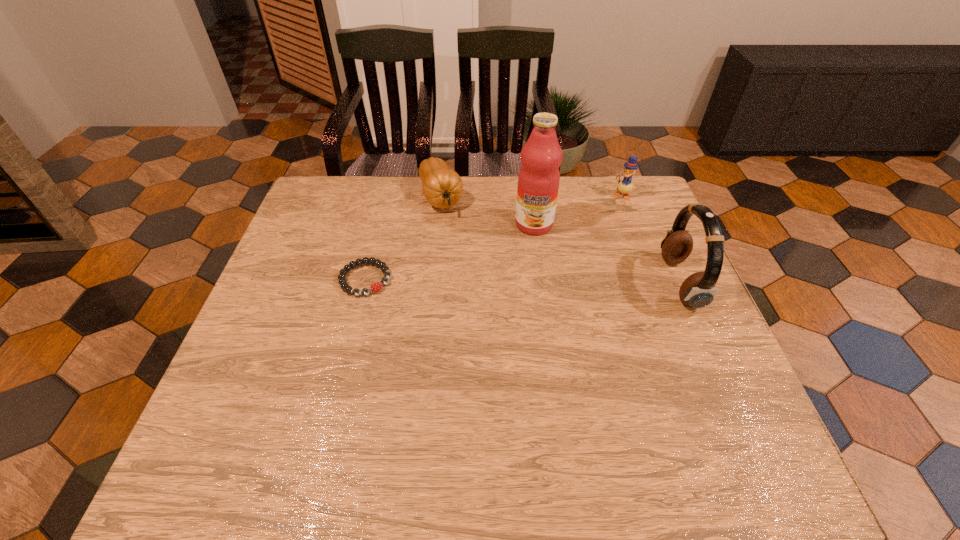
The image size is (960, 540). In order to click on vacant space situated on the label of the tallest object in this screenshot , I will do point(522,273).

In order to click on vacant space located on the face of the duckling, where the monocle is placed in this screenshot , I will do `click(562, 267)`.

Find the location of a particular element. The width and height of the screenshot is (960, 540). vacant space located 0.250m on the face of the duckling, where the monocle is placed is located at coordinates (582, 242).

The image size is (960, 540). Find the location of `blank space located on the face of the duckling, where the monocle is placed`. blank space located on the face of the duckling, where the monocle is placed is located at coordinates (560, 269).

Where is `blank space located 0.230m on the stem side of the fourth object from right to left`? The width and height of the screenshot is (960, 540). blank space located 0.230m on the stem side of the fourth object from right to left is located at coordinates (470, 271).

Where is `vacant region located on the stem side of the fourth object from right to left`? This screenshot has height=540, width=960. vacant region located on the stem side of the fourth object from right to left is located at coordinates (477, 287).

Find the location of a particular element. vacant space located 0.380m on the stem side of the fourth object from right to left is located at coordinates (489, 314).

The width and height of the screenshot is (960, 540). Identify the location of fruit juice that is at the far edge. tap(538, 181).

Identify the location of duckling positioned at the far edge. This screenshot has height=540, width=960. (625, 186).

The height and width of the screenshot is (540, 960). Find the location of `gourd that is at the far edge`. gourd that is at the far edge is located at coordinates (442, 187).